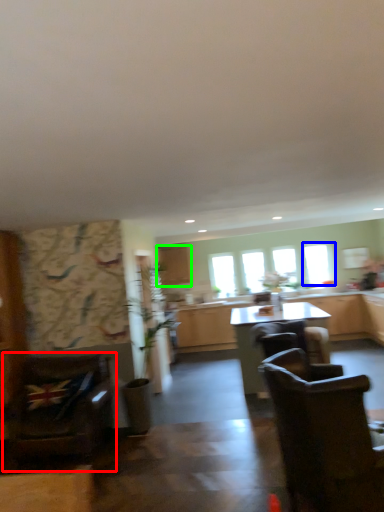
Question: Which object is positioned closest to chair (highlighted by a red box)? Select from window (highlighted by a blue box) and cabinetry (highlighted by a green box).

Choices:
 (A) window
 (B) cabinetry

Answer: (B)